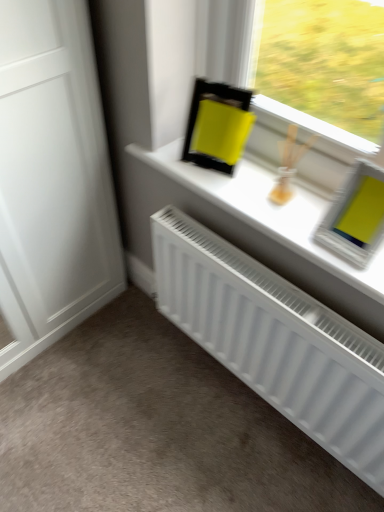
What is the approximate width of white matte radiator at lower center?

82.52 centimeters.

You are a GUI agent. You are given a task and a screenshot of the screen. Output one action in this format:
    pyautogui.click(x=<x>, y=<y>)
    Task: Click on the white matte radiator at lower center
    Image resolution: width=384 pixels, height=512 pixels.
    Given the screenshot: What is the action you would take?
    pyautogui.click(x=154, y=429)

Considering the points (129, 458) and (278, 229), which point is in front, point (129, 458) or point (278, 229)?

The point (278, 229) is closer.

In terms of size, does white matte radiator at lower center appear bigger or smaller than white matte window sill at upper center?

In the image, white matte radiator at lower center appears to be larger than white matte window sill at upper center.

From the image's perspective, is white matte radiator at lower center located above or below white matte window sill at upper center?

Clearly, from the image's perspective, white matte radiator at lower center is below white matte window sill at upper center.

Between white matte radiator at lower center and white matte window sill at upper center, which one has less height?

Standing shorter between the two is white matte window sill at upper center.

In the scene shown: Which of these two, white matte radiator at lower center or white matte radiator at lower center, is wider?

white matte radiator at lower center is wider.

Does point (239, 446) come in front of point (259, 356)?

No.

In terms of height, does white matte radiator at lower center look taller or shorter compared to white matte radiator at lower center?

In the image, white matte radiator at lower center appears to be shorter than white matte radiator at lower center.

Locate an element on the screen. radiator lying in front of the white matte radiator at lower center is located at coordinates (275, 340).

Is white matte radiator at lower center in front of white matte radiator at lower center?

Yes, the depth of white matte radiator at lower center is less than that of white matte radiator at lower center.

Is white matte radiator at lower center shorter than white matte radiator at lower center?

In fact, white matte radiator at lower center may be taller than white matte radiator at lower center.

Looking at this image, is white matte radiator at lower center to the right of white matte radiator at lower center from the viewer's perspective?

Correct, you'll find white matte radiator at lower center to the right of white matte radiator at lower center.

Based on their sizes in the image, would you say white matte radiator at lower center is bigger or smaller than white matte radiator at lower center?

In the image, white matte radiator at lower center appears to be smaller than white matte radiator at lower center.

From the image's perspective, is white matte radiator at lower center on white matte window sill at upper center?

Incorrect, from the image's perspective, white matte radiator at lower center is lower than white matte window sill at upper center.

Which of these two, white matte radiator at lower center or white matte window sill at upper center, is wider?

white matte window sill at upper center is wider.

Does white matte radiator at lower center have a greater height compared to white matte window sill at upper center?

Yes, white matte radiator at lower center is taller than white matte window sill at upper center.

Which is closer to the camera, (316, 419) or (248, 173)?

Clearly, point (316, 419) is more distant from the camera than point (248, 173).

Can you confirm if white matte window sill at upper center is shorter than white matte radiator at lower center?

Indeed, white matte window sill at upper center has a lesser height compared to white matte radiator at lower center.

Between white matte window sill at upper center and white matte radiator at lower center, which one has smaller size?

white matte window sill at upper center is smaller.

Considering the sizes of objects white matte window sill at upper center and white matte radiator at lower center in the image provided, who is thinner, white matte window sill at upper center or white matte radiator at lower center?

white matte window sill at upper center.

Considering the points (247, 176) and (124, 500), which point is in front, point (247, 176) or point (124, 500)?

Positioned in front is point (247, 176).

What's the angular difference between white matte window sill at upper center and white matte radiator at lower center's facing directions?

There is a 0.000384-degree angle between the facing directions of white matte window sill at upper center and white matte radiator at lower center.

Is white matte window sill at upper center located outside white matte radiator at lower center?

That's correct, white matte window sill at upper center is outside of white matte radiator at lower center.

Considering the relative sizes of white matte window sill at upper center and white matte radiator at lower center in the image provided, is white matte window sill at upper center thinner than white matte radiator at lower center?

In fact, white matte window sill at upper center might be wider than white matte radiator at lower center.

Is white matte window sill at upper center not near white matte radiator at lower center?

They are positioned close to each other.

Identify the location of window sill above the white matte radiator at lower center (from a real-world perspective). The image size is (384, 512). (266, 211).

Where is `plain below the white matte radiator at lower center (from a real-world perspective)`? plain below the white matte radiator at lower center (from a real-world perspective) is located at coordinates (154, 429).

Based on their spatial positions, is white matte window sill at upper center or white matte radiator at lower center further from white matte radiator at lower center?

The object further to white matte radiator at lower center is white matte window sill at upper center.

Based on the photo, based on their spatial positions, is white matte radiator at lower center or white matte radiator at lower center closer to white matte window sill at upper center?

The object closer to white matte window sill at upper center is white matte radiator at lower center.

Based on their spatial positions, is white matte radiator at lower center or white matte radiator at lower center closer to white matte window sill at upper center?

white matte radiator at lower center is closer to white matte window sill at upper center.

Based on their spatial positions, is white matte window sill at upper center or white matte radiator at lower center closer to white matte radiator at lower center?

The object closer to white matte radiator at lower center is white matte window sill at upper center.

Which object lies further to the anchor point white matte radiator at lower center, white matte radiator at lower center or white matte window sill at upper center?

Among the two, white matte radiator at lower center is located further to white matte radiator at lower center.

When comparing their distances from white matte radiator at lower center, does white matte radiator at lower center or white matte window sill at upper center seem closer?

white matte radiator at lower center.

Image resolution: width=384 pixels, height=512 pixels. What are the coordinates of `radiator between white matte window sill at upper center and white matte radiator at lower center vertically` in the screenshot? It's located at (275, 340).